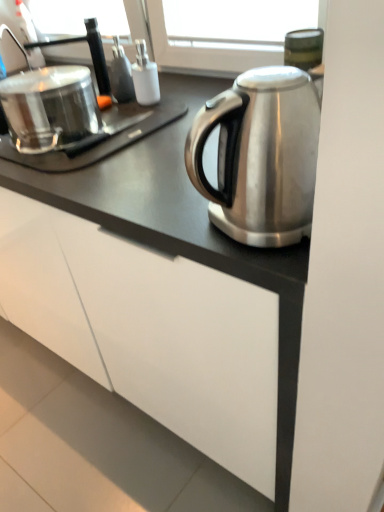
This screenshot has width=384, height=512. I want to click on shiny metallic pot at left, so click(51, 109).

Find the location of a particular element. The height and width of the screenshot is (512, 384). white matte cabinet at lower center is located at coordinates (149, 330).

From a real-world perspective, which object rests below the other?

In real-world perspective, shiny metallic pot at left is lower.

Considering the relative sizes of brushed metal faucet at upper left and shiny metallic pot at left in the image provided, is brushed metal faucet at upper left bigger than shiny metallic pot at left?

Actually, brushed metal faucet at upper left might be smaller than shiny metallic pot at left.

Who is shorter, brushed metal faucet at upper left or shiny metallic pot at left?

brushed metal faucet at upper left.

Choose the correct answer: Is brushed metal faucet at upper left inside shiny metallic pot at left or outside it?

brushed metal faucet at upper left is spatially situated outside shiny metallic pot at left.

Does white matte cabinet at lower center turn towards brushed metal faucet at upper left?

No, white matte cabinet at lower center does not turn towards brushed metal faucet at upper left.

Is white matte cabinet at lower center far away from brushed metal faucet at upper left?

No, there isn't a large distance between white matte cabinet at lower center and brushed metal faucet at upper left.

From the image's perspective, is white matte cabinet at lower center positioned above or below brushed metal faucet at upper left?

From the image's perspective, white matte cabinet at lower center appears below brushed metal faucet at upper left.

Considering the relative sizes of white matte cabinet at lower center and brushed metal faucet at upper left in the image provided, is white matte cabinet at lower center bigger than brushed metal faucet at upper left?

Yes.

Based on the photo, does shiny metallic pot at left have a larger size compared to brushed metal faucet at upper left?

Yes.

From the image's perspective, between shiny metallic pot at left and brushed metal faucet at upper left, who is located below?

shiny metallic pot at left.

Is shiny metallic pot at left next to brushed metal faucet at upper left and touching it?

No, shiny metallic pot at left is not beside brushed metal faucet at upper left.

Is shiny metallic pot at left looking in the opposite direction of brushed metal faucet at upper left?

No, brushed metal faucet at upper left is not at the back of shiny metallic pot at left.

In the scene shown: Is white matte cabinet at lower center inside shiny metallic pot at left?

Definitely not — white matte cabinet at lower center is not inside shiny metallic pot at left.

In the scene shown: From their relative heights in the image, would you say shiny metallic pot at left is taller or shorter than white matte cabinet at lower center?

shiny metallic pot at left is taller than white matte cabinet at lower center.

Which is behind, shiny metallic pot at left or white matte cabinet at lower center?

Positioned behind is shiny metallic pot at left.

Which is more to the right, brushed metal faucet at upper left or white matte cabinet at lower center?

brushed metal faucet at upper left is more to the right.

Between brushed metal faucet at upper left and white matte cabinet at lower center, which one has larger width?

white matte cabinet at lower center.

Is brushed metal faucet at upper left directly adjacent to white matte cabinet at lower center?

No, brushed metal faucet at upper left is not beside white matte cabinet at lower center.

Does white matte cabinet at lower center have a larger size compared to shiny metallic pot at left?

Yes.

Can you confirm if white matte cabinet at lower center is positioned to the right of shiny metallic pot at left?

No.

Where is `cabinetry in front of the shiny metallic pot at left`? The image size is (384, 512). cabinetry in front of the shiny metallic pot at left is located at coordinates (149, 330).

From the image's perspective, which one is positioned higher, white matte cabinet at lower center or shiny metallic pot at left?

From the image's view, shiny metallic pot at left is above.

Image resolution: width=384 pixels, height=512 pixels. I want to click on faucet behind the shiny metallic pot at left, so click(90, 52).

Locate an element on the screen. The image size is (384, 512). cabinetry that appears on the left of brushed metal faucet at upper left is located at coordinates (149, 330).

Which object lies nearer to the anchor point shiny metallic pot at left, brushed metal faucet at upper left or white matte cabinet at lower center?

The object closer to shiny metallic pot at left is brushed metal faucet at upper left.

Considering their positions, is white matte cabinet at lower center positioned further to brushed metal faucet at upper left than shiny metallic pot at left?

white matte cabinet at lower center is positioned further to the anchor brushed metal faucet at upper left.

Looking at the image, which one is located further to white matte cabinet at lower center, brushed metal faucet at upper left or shiny metallic pot at left?

The object further to white matte cabinet at lower center is brushed metal faucet at upper left.

Estimate the real-world distances between objects in this image. Which object is closer to white matte cabinet at lower center, shiny metallic pot at left or brushed metal faucet at upper left?

shiny metallic pot at left is positioned closer to the anchor white matte cabinet at lower center.

Looking at the image, which one is located closer to brushed metal faucet at upper left, shiny metallic pot at left or white matte cabinet at lower center?

Among the two, shiny metallic pot at left is located nearer to brushed metal faucet at upper left.

Estimate the real-world distances between objects in this image. Which object is closer to shiny metallic pot at left, white matte cabinet at lower center or brushed metal faucet at upper left?

brushed metal faucet at upper left is closer to shiny metallic pot at left.

You are a GUI agent. You are given a task and a screenshot of the screen. Output one action in this format:
    pyautogui.click(x=<x>, y=<y>)
    Task: Click on the appliance between brushed metal faucet at upper left and white matte cabinet at lower center vertically
    This screenshot has width=384, height=512.
    Given the screenshot: What is the action you would take?
    pyautogui.click(x=51, y=109)